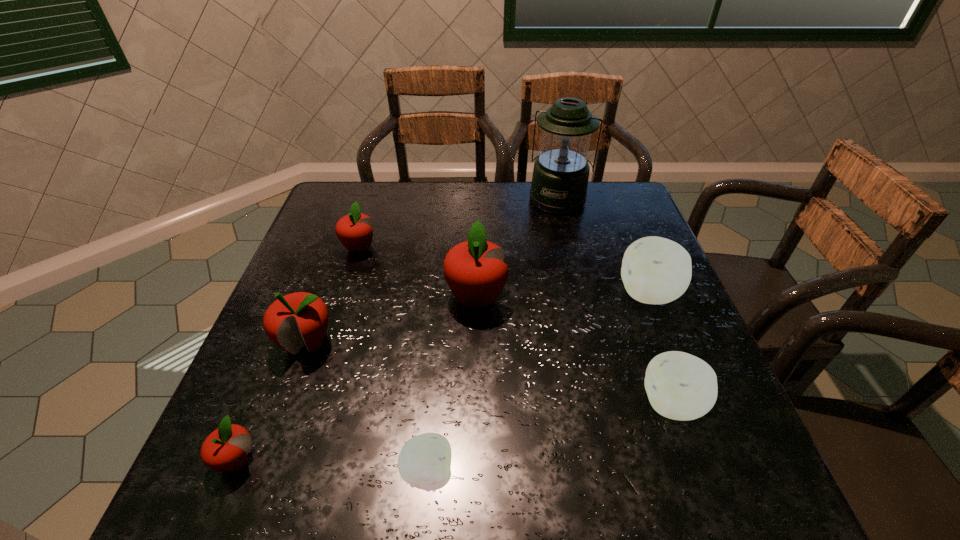
Image resolution: width=960 pixels, height=540 pixels. Identify the location of the second biggest white apple. (680, 386).

This screenshot has width=960, height=540. Find the location of `the nearest white apple`. the nearest white apple is located at coordinates (424, 462).

Locate an element on the screen. The height and width of the screenshot is (540, 960). the leftmost white apple is located at coordinates (424, 462).

Where is `the smallest red apple`? the smallest red apple is located at coordinates (226, 448).

This screenshot has height=540, width=960. In order to click on vacant area situated on the left of the farthest object in this screenshot , I will do `click(487, 198)`.

Locate an element on the screen. vacant space located 0.190m on the front of the second tallest object is located at coordinates (475, 394).

Where is `blank space located on the back of the biggest white apple`? blank space located on the back of the biggest white apple is located at coordinates (631, 248).

Where is `free region located on the front of the second nearest red apple`? Image resolution: width=960 pixels, height=540 pixels. free region located on the front of the second nearest red apple is located at coordinates (267, 451).

Locate an element on the screen. Image resolution: width=960 pixels, height=540 pixels. vacant space located on the front of the farthest red apple is located at coordinates (332, 334).

Locate an element on the screen. free point located 0.180m on the left of the second farthest white apple is located at coordinates (547, 404).